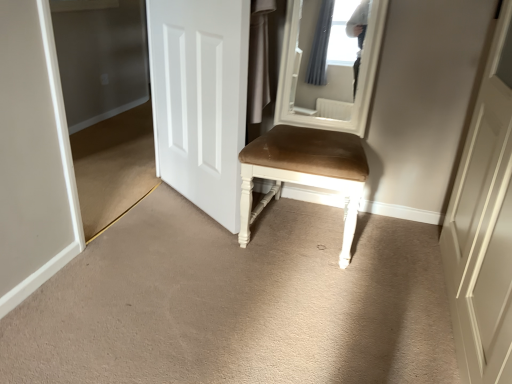
You are a GUI agent. You are given a task and a screenshot of the screen. Output one action in this format:
    pyautogui.click(x=<x>, y=<y>)
    Task: Click on the free point below suede-like brown chair at center (from a real-world perspective)
    The height and width of the screenshot is (384, 512).
    Given the screenshot: What is the action you would take?
    pyautogui.click(x=301, y=229)